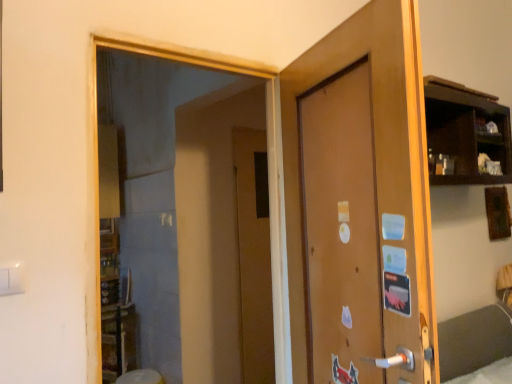
Question: In terms of size, does brown matte door at center, which is the 2th door in back-to-front order, appear bigger or smaller than brown matte door at center, acting as the first door starting from the back?

Choices:
 (A) big
 (B) small

Answer: (A)

Question: Would you say brown matte door at center, which is the 2th door in back-to-front order, is inside or outside brown matte door at center, acting as the 2th door starting from the front?

Choices:
 (A) outside
 (B) inside

Answer: (A)

Question: Which of these objects is positioned farthest from the transparent glass mirror at upper left?

Choices:
 (A) brown matte door at center, which is the 2th door in back-to-front order
 (B) brown matte door at center, acting as the first door starting from the back

Answer: (A)

Question: Which is nearer to the brown matte door at center, which appears as the first door when viewed from the front?

Choices:
 (A) transparent glass mirror at upper left
 (B) brown matte door at center, acting as the 2th door starting from the front

Answer: (A)